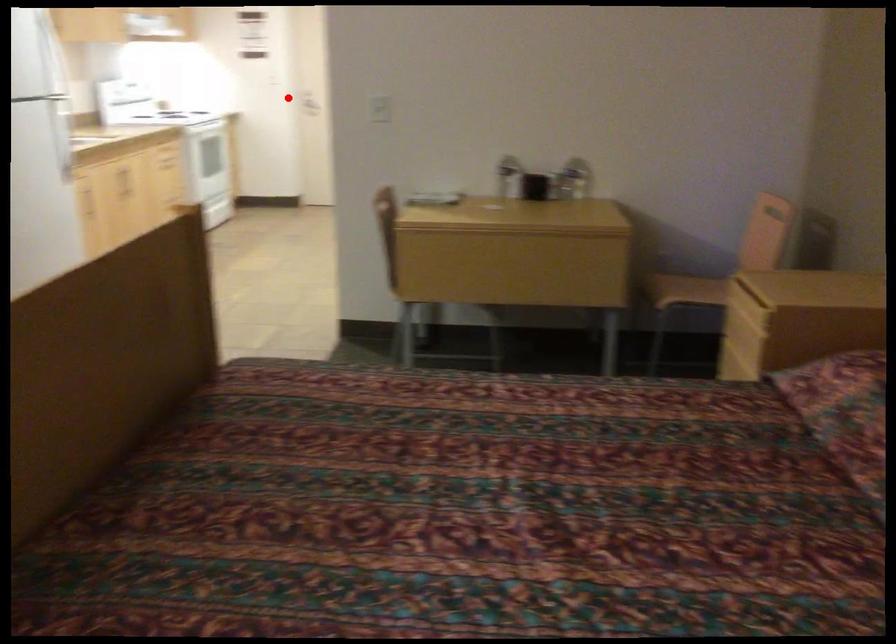
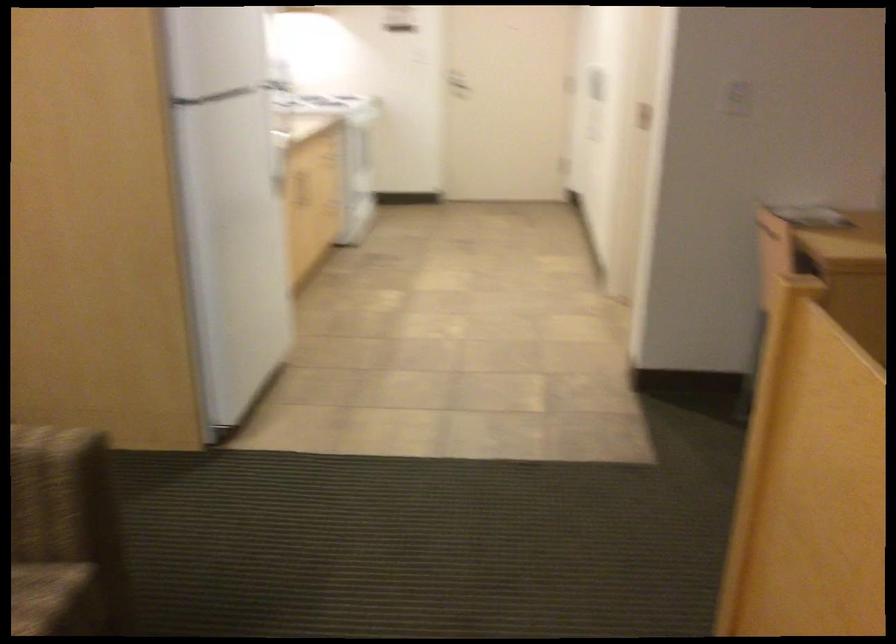
Question: I am providing you with two images of the same scene from different viewpoints. Given a red point in image1, look at the same physical point in image2. Is it:

Choices:
 (A) Closer to the viewpoint
 (B) Farther from the viewpoint

Answer: (A)